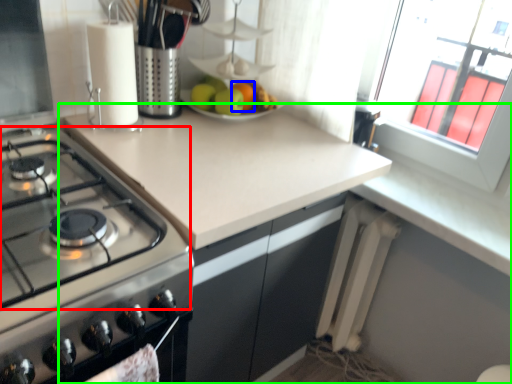
Question: Which is farther away from gas stove (highlighted by a red box)? orange (highlighted by a blue box) or countertop (highlighted by a green box)?

Choices:
 (A) orange
 (B) countertop

Answer: (A)